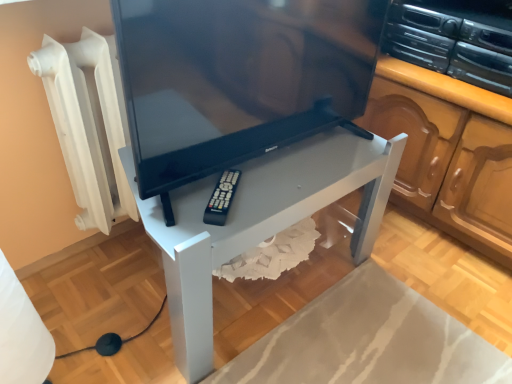
Question: Is black glossy tv at center facing towards black plastic remote at lower center?

Choices:
 (A) yes
 (B) no

Answer: (A)

Question: Is black glossy tv at center at the right side of black plastic remote at lower center?

Choices:
 (A) no
 (B) yes

Answer: (B)

Question: Is black glossy tv at center far from black plastic remote at lower center?

Choices:
 (A) yes
 (B) no

Answer: (B)

Question: From the image's perspective, is black glossy tv at center located above black plastic remote at lower center?

Choices:
 (A) no
 (B) yes

Answer: (B)

Question: Can you confirm if black glossy tv at center is taller than black plastic remote at lower center?

Choices:
 (A) yes
 (B) no

Answer: (A)

Question: From a real-world perspective, is black glossy tv at center located higher than black plastic remote at lower center?

Choices:
 (A) no
 (B) yes

Answer: (B)

Question: Considering the relative sizes of black glossy tv at center and white glossy table at center in the image provided, is black glossy tv at center thinner than white glossy table at center?

Choices:
 (A) no
 (B) yes

Answer: (B)

Question: Is black glossy tv at center far away from white glossy table at center?

Choices:
 (A) no
 (B) yes

Answer: (A)

Question: From a real-world perspective, is black glossy tv at center physically below white glossy table at center?

Choices:
 (A) yes
 (B) no

Answer: (B)

Question: Does black glossy tv at center have a greater height compared to white glossy table at center?

Choices:
 (A) yes
 (B) no

Answer: (B)

Question: Does black glossy tv at center appear on the right side of white glossy table at center?

Choices:
 (A) no
 (B) yes

Answer: (B)

Question: Considering the relative sizes of black glossy tv at center and white glossy table at center in the image provided, is black glossy tv at center wider than white glossy table at center?

Choices:
 (A) no
 (B) yes

Answer: (A)

Question: From the image's perspective, does black plastic remote at lower center appear higher than white glossy table at center?

Choices:
 (A) yes
 (B) no

Answer: (A)